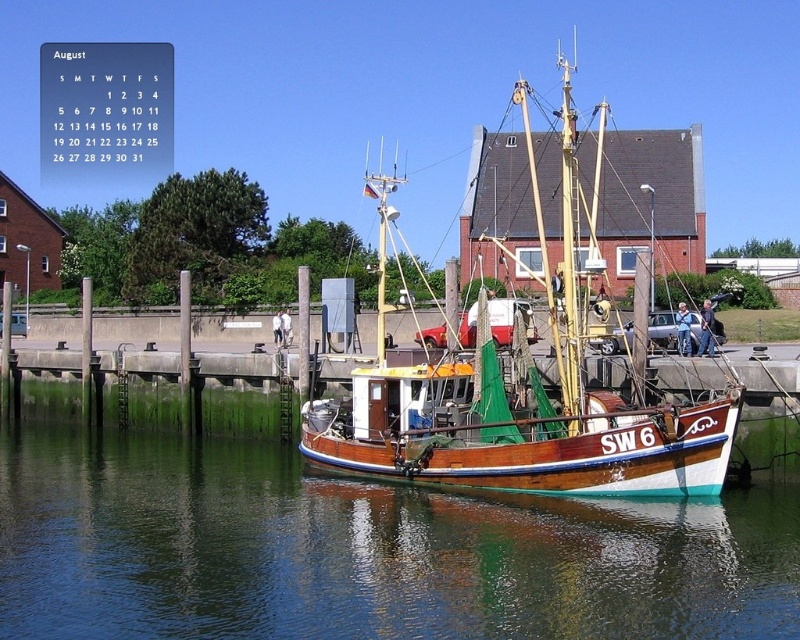
Consider the image. You are standing on the pier and want to locate the glossy water at boat right. According to the coordinates provided, where should you look relative to the boat?

The glossy water at boat right is located at coordinates point (364, 552), so you should look to the right side of the boat to find it.

You are a sailor standing on the wooden boat at center. You want to check the water level near the boat. Which direction should you look to see the glossy water at boat right?

The glossy water at boat right is below the wooden boat at center, so you should look downward towards the boat right to see the water level.

You are standing at the point marked as point (540,524) and want to walk to the wooden fishing boat docked at the pier. The path is 104.24 feet long. If you walk at a speed of 3 feet per second, how many seconds will it take you to reach the boat?

The distance between point (540,524) and the wooden fishing boat docked at the pier is 104.24 feet. At a walking speed of 3 feet per second, dividing the distance by the speed gives 104.24 divided by 3, which equals approximately 34.75 seconds. So, it will take about 35 seconds to reach the boat.